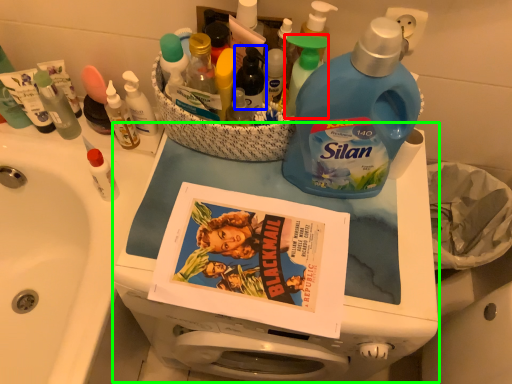
Question: Which object is positioned closest to cleaning product (highlighted by a red box)? Select from bottle (highlighted by a blue box) and appliance (highlighted by a green box).

Choices:
 (A) bottle
 (B) appliance

Answer: (A)